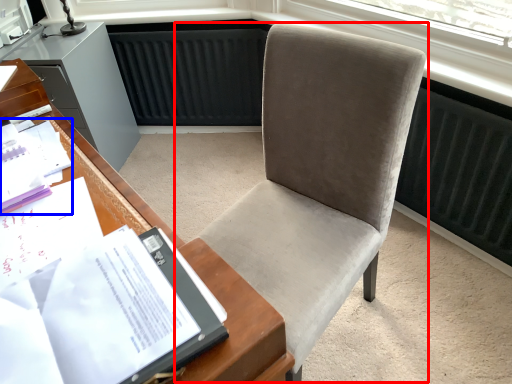
Question: Which object is closer to the camera taking this photo, chair (highlighted by a red box) or book (highlighted by a blue box)?

Choices:
 (A) chair
 (B) book

Answer: (A)